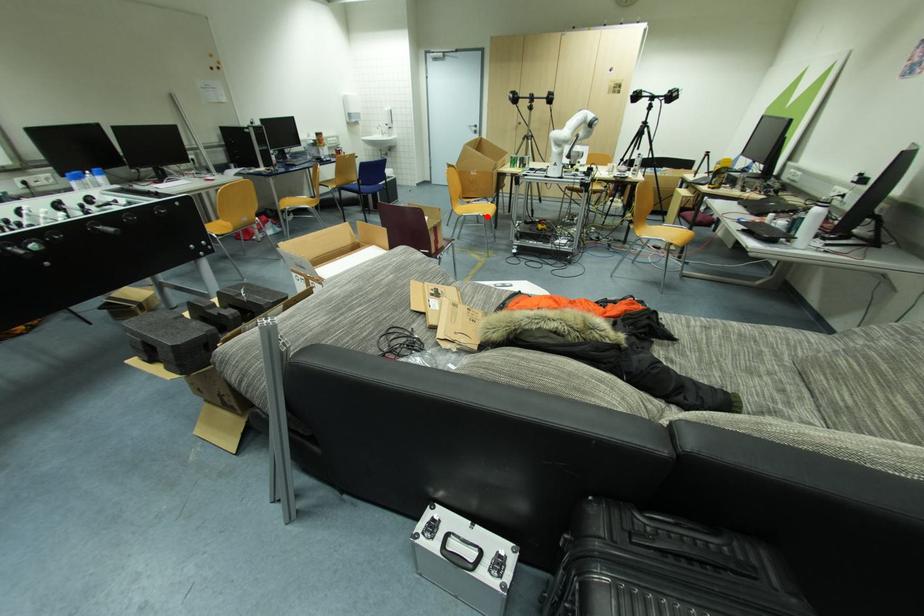
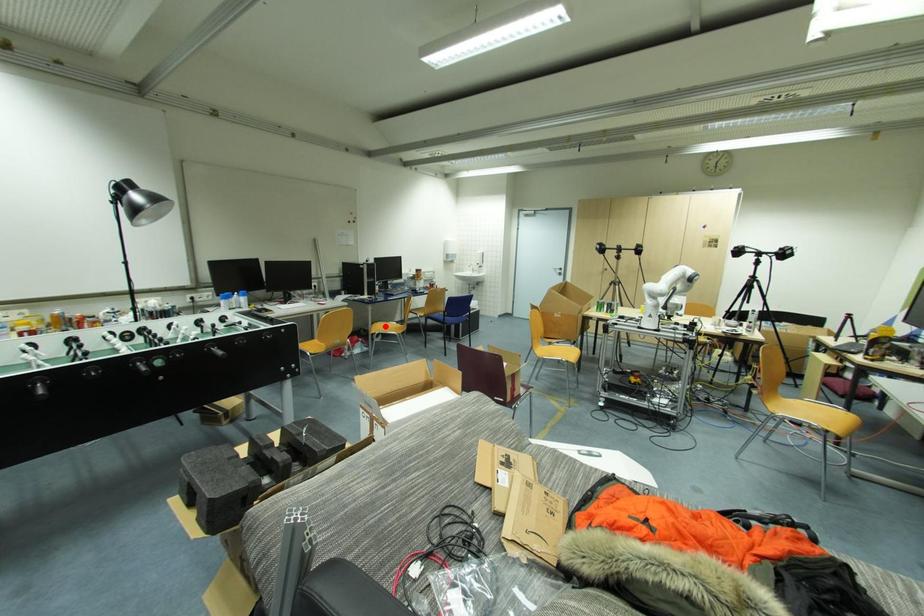
I am providing you with two images of the same scene from different viewpoints. A red point is marked on the first image and another point is marked on the second image. Does the point marked in image1 correspond to the same location as the one in image2?

No